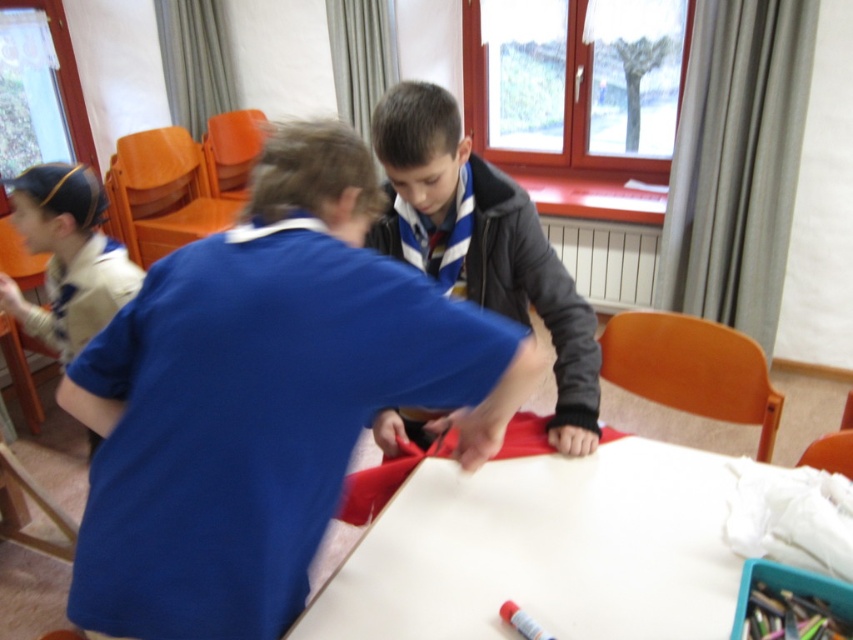
Who is positioned more to the right, white matte table at center or matte plastic crayon at lower center?

Positioned to the right is white matte table at center.

Who is lower down, white matte table at center or matte plastic crayon at lower center?

matte plastic crayon at lower center is lower down.

Is point (614, 609) farther from camera compared to point (529, 627)?

Yes, point (614, 609) is behind point (529, 627).

Image resolution: width=853 pixels, height=640 pixels. Find the location of `white matte table at center`. white matte table at center is located at coordinates (543, 550).

This screenshot has height=640, width=853. Describe the element at coordinates (543, 550) in the screenshot. I see `white matte table at center` at that location.

Can you confirm if white matte table at center is positioned to the left of dark gray woolen sweater at center?

In fact, white matte table at center is to the right of dark gray woolen sweater at center.

Between point (589, 465) and point (503, 296), which one is positioned in front?

Point (589, 465)

Identify the location of white matte table at center. Image resolution: width=853 pixels, height=640 pixels. (543, 550).

Does blue fabric at center come in front of white matte table at center?

Yes.

Can you confirm if blue fabric at center is thinner than white matte table at center?

Indeed, blue fabric at center has a lesser width compared to white matte table at center.

Does point (315, 170) lie in front of point (675, 481)?

Yes, point (315, 170) is closer to viewer.

Where is `blue fabric at center`? The height and width of the screenshot is (640, 853). blue fabric at center is located at coordinates (263, 397).